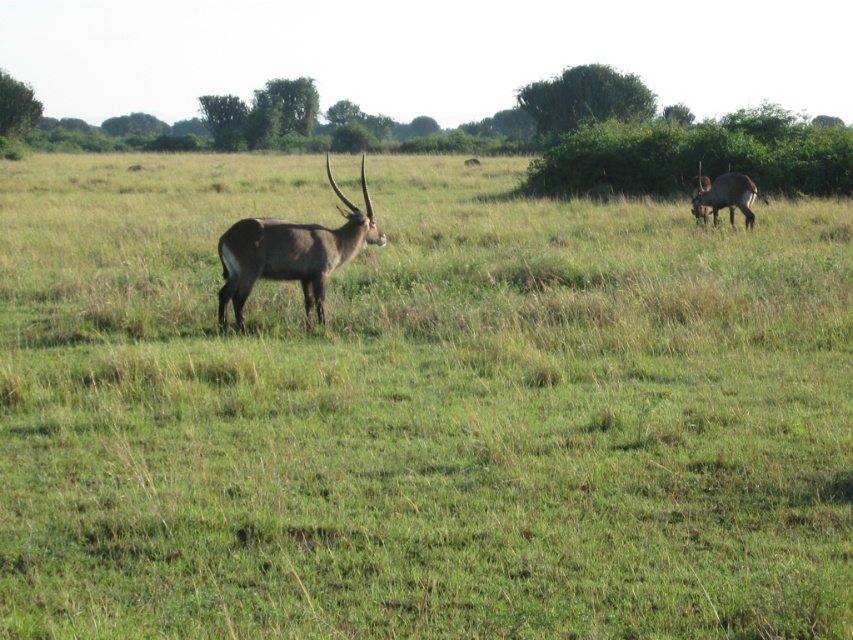
Question: Which of the following is the closest to the observer?

Choices:
 (A) brown glossy antelope at center
 (B) brown glossy antelope at upper right

Answer: (A)

Question: Which point is closer to the camera?

Choices:
 (A) (254, 260)
 (B) (730, 193)

Answer: (A)

Question: Can you confirm if brown glossy antelope at center is positioned to the left of brown glossy antelope at upper right?

Choices:
 (A) no
 (B) yes

Answer: (B)

Question: Can you confirm if brown glossy antelope at center is wider than brown glossy antelope at upper right?

Choices:
 (A) yes
 (B) no

Answer: (A)

Question: From the image, what is the correct spatial relationship of brown glossy antelope at center in relation to brown glossy antelope at upper right?

Choices:
 (A) right
 (B) left

Answer: (B)